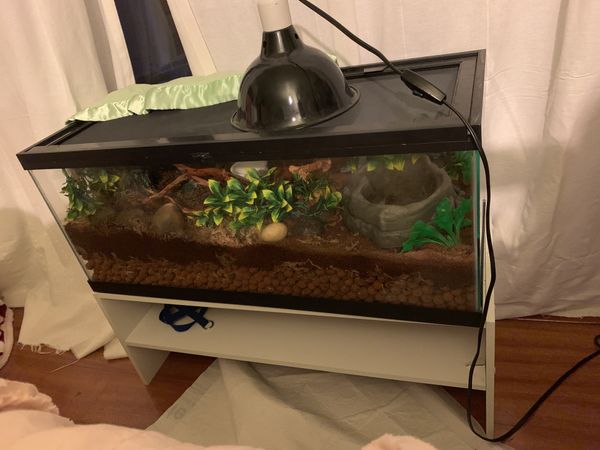
The height and width of the screenshot is (450, 600). I want to click on shelf, so click(339, 349).